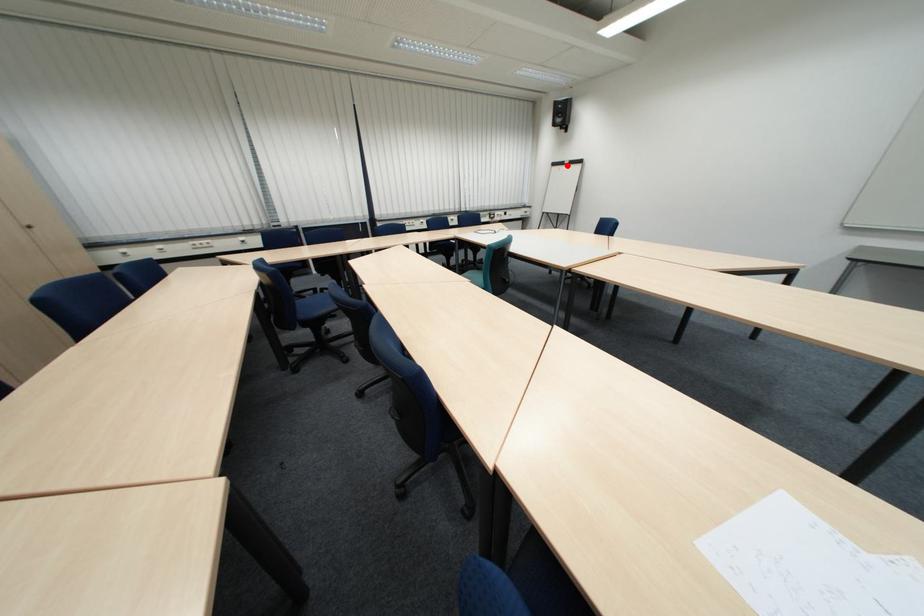
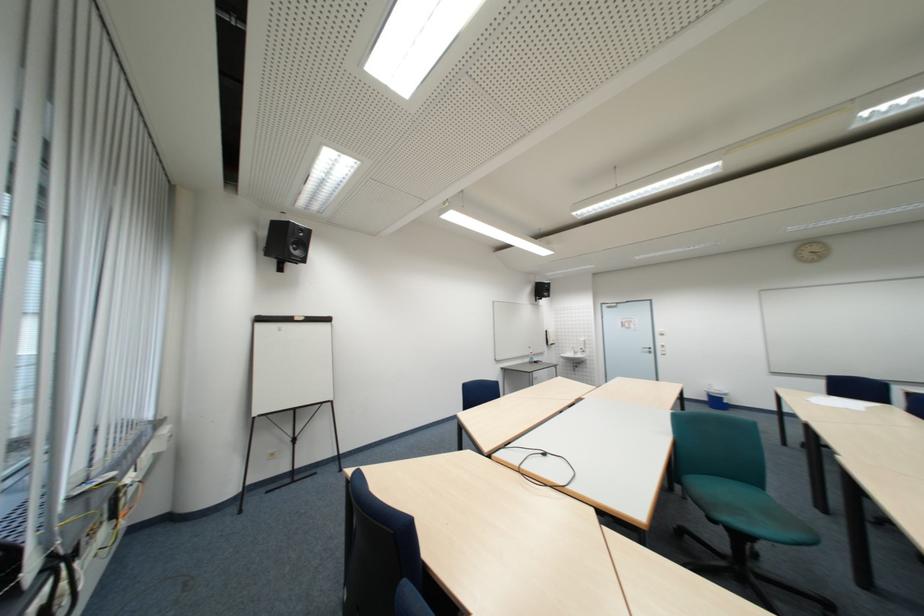
Question: I am providing you with two images of the same scene from different viewpoints. Given a red point in image1, look at the same physical point in image2. Is it:

Choices:
 (A) Closer to the viewpoint
 (B) Farther from the viewpoint

Answer: (B)